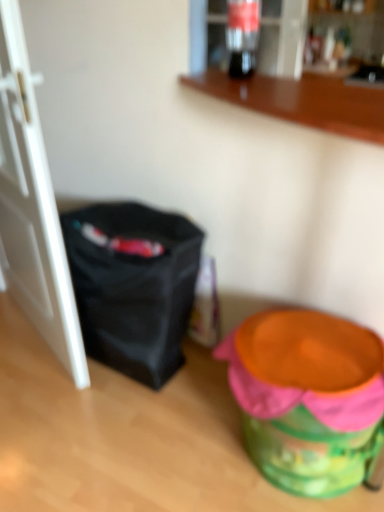
Image resolution: width=384 pixels, height=512 pixels. Identify the location of vacant space that is to the left of translucent glass soda at upper center. (210, 75).